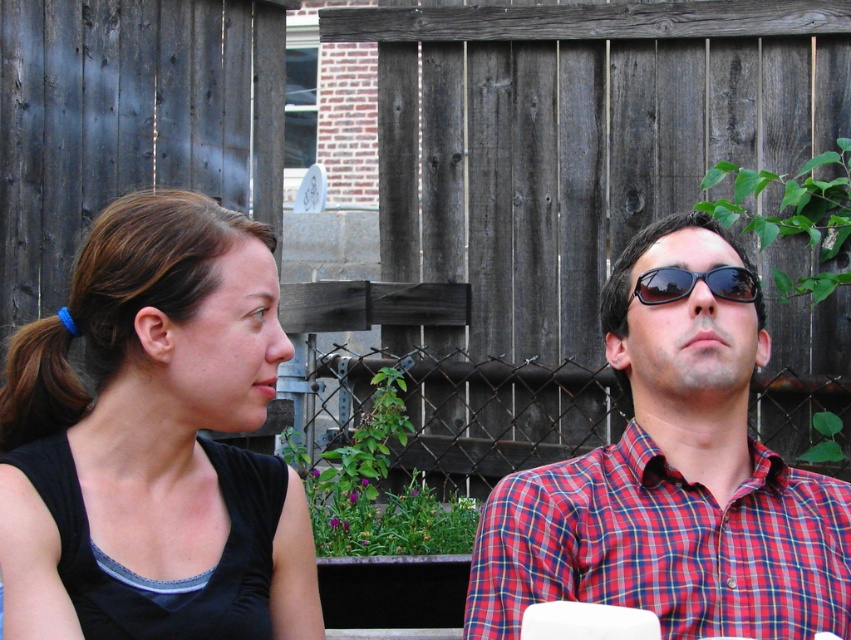
Looking at this image, does black matte shirt at center have a greater width compared to black reflective sunglasses at upper center?

Yes.

Is black matte shirt at center above black reflective sunglasses at upper center?

No.

What do you see at coordinates (153, 440) in the screenshot?
I see `black matte shirt at center` at bounding box center [153, 440].

The width and height of the screenshot is (851, 640). I want to click on black matte shirt at center, so click(153, 440).

Which of these two, black fabric at left or black reflective sunglasses at upper center, stands taller?

With more height is black fabric at left.

Which of these two, black fabric at left or black reflective sunglasses at upper center, stands shorter?

black reflective sunglasses at upper center is shorter.

Is point (229, 388) positioned in front of point (717, 273)?

Yes, it is in front of point (717, 273).

Where is `black fabric at left`? black fabric at left is located at coordinates (136, 403).

This screenshot has height=640, width=851. Identify the location of black matte shirt at center. (153, 440).

Can you confirm if black matte shirt at center is smaller than plaid shirt at center?

Correct, black matte shirt at center occupies less space than plaid shirt at center.

Between point (6, 481) and point (666, 564), which one is positioned in front?

Positioned in front is point (6, 481).

I want to click on black matte shirt at center, so click(153, 440).